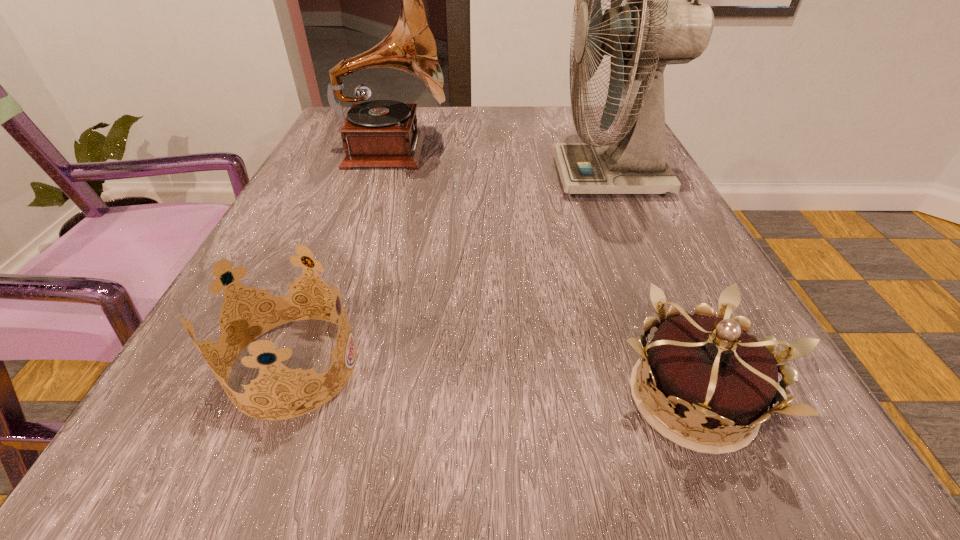
The image size is (960, 540). In the image, there is a desktop. In order to click on vacant space at the far edge in this screenshot , I will do `click(531, 140)`.

Locate an element on the screen. This screenshot has width=960, height=540. blank area at the near edge is located at coordinates (410, 474).

Find the location of a particular element. Image resolution: width=960 pixels, height=540 pixels. free point at the right edge is located at coordinates (660, 262).

Image resolution: width=960 pixels, height=540 pixels. What are the coordinates of `vacant region at the near left corner` in the screenshot? It's located at (278, 463).

This screenshot has width=960, height=540. I want to click on unoccupied area between the third shortest object and the left crown, so click(344, 258).

Where is `empty space that is in between the right crown and the phonograph_record`? The width and height of the screenshot is (960, 540). empty space that is in between the right crown and the phonograph_record is located at coordinates tap(542, 275).

Where is `free spot between the left crown and the fan`? free spot between the left crown and the fan is located at coordinates (452, 271).

Find the location of a particular element. This screenshot has width=960, height=540. free area in between the phonograph_record and the left crown is located at coordinates (344, 258).

Identify the location of vacant area that lies between the left crown and the fan. pos(452,271).

Where is `vacant space in between the third shortest object and the left crown`? This screenshot has width=960, height=540. vacant space in between the third shortest object and the left crown is located at coordinates (344, 258).